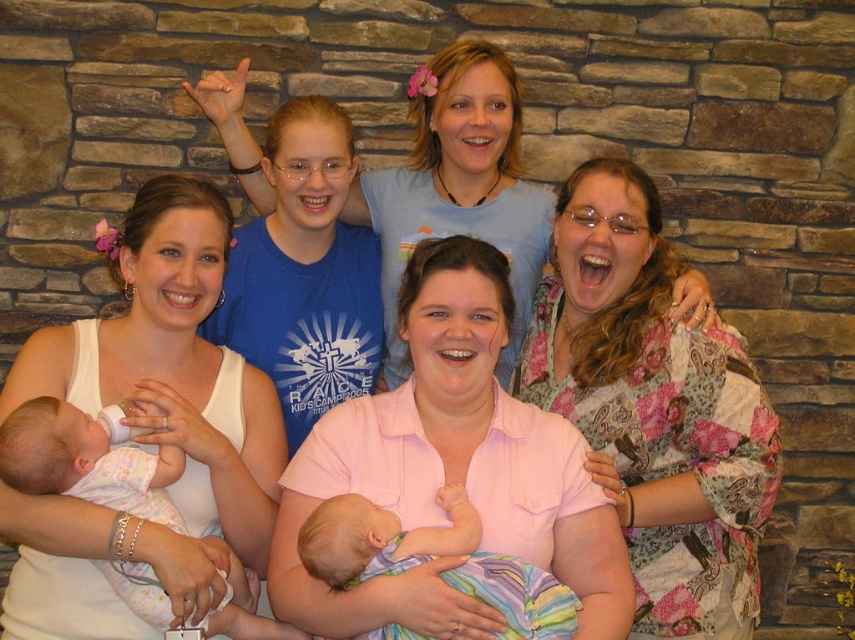
Does pink fabric shirt at center have a greater height compared to soft pastel striped blanket at center?

Yes.

Which of these two, pink fabric shirt at center or soft pastel striped blanket at center, stands taller?

pink fabric shirt at center

Is point (494, 186) less distant than point (553, 592)?

No, (494, 186) is further to viewer.

The height and width of the screenshot is (640, 855). Identify the location of pink fabric shirt at center. (458, 184).

Which is more to the left, pink cotton shirt at center or white cotton onesie at lower left?

white cotton onesie at lower left is more to the left.

Between point (532, 561) and point (92, 464), which one is positioned behind?

Positioned behind is point (532, 561).

Between point (332, 460) and point (121, 579), which one is positioned behind?

The point (332, 460) is behind.

At what (x,y) coordinates should I click in order to perform the action: click on pink cotton shirt at center. Please return your answer as a coordinate pair (x, y). The width and height of the screenshot is (855, 640). Looking at the image, I should click on (453, 468).

Is floral-patterned kimono at right below soft pastel striped blanket at center?

Actually, floral-patterned kimono at right is above soft pastel striped blanket at center.

Does floral-patterned kimono at right have a smaller size compared to soft pastel striped blanket at center?

No.

Image resolution: width=855 pixels, height=640 pixels. I want to click on floral-patterned kimono at right, so click(653, 408).